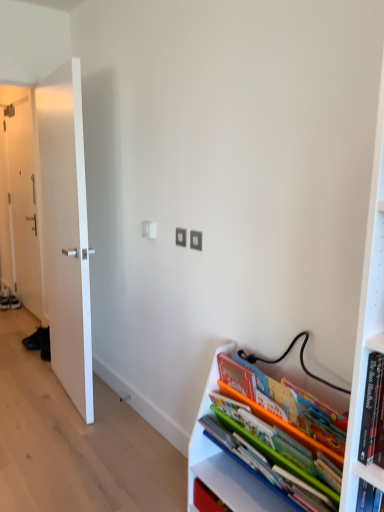
Locate an element on the screen. vacant area that is in front of white smooth door at left, marked as the 1th door in a right-to-left arrangement is located at coordinates (58, 429).